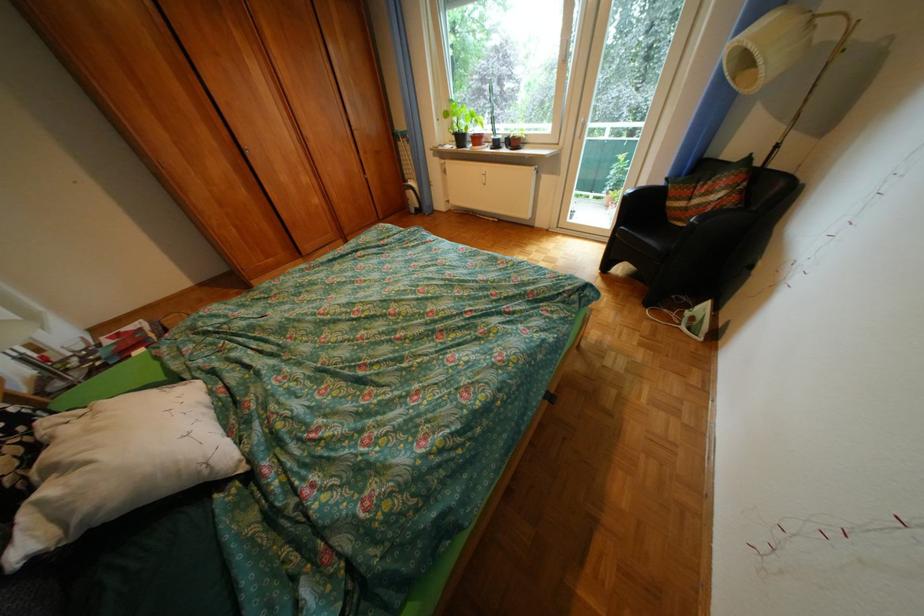
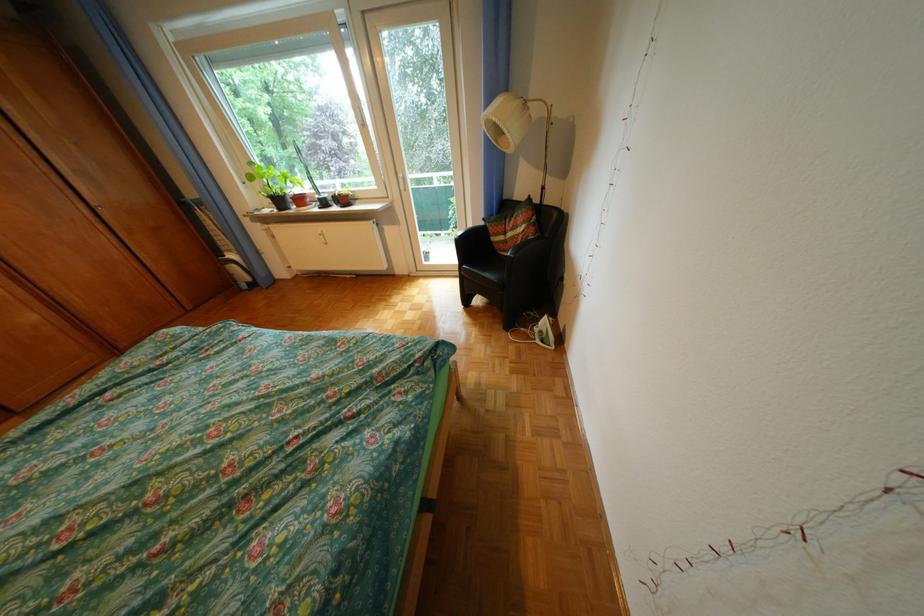
Where in the second image is the point corresponding to [514,140] from the first image?

(341, 199)